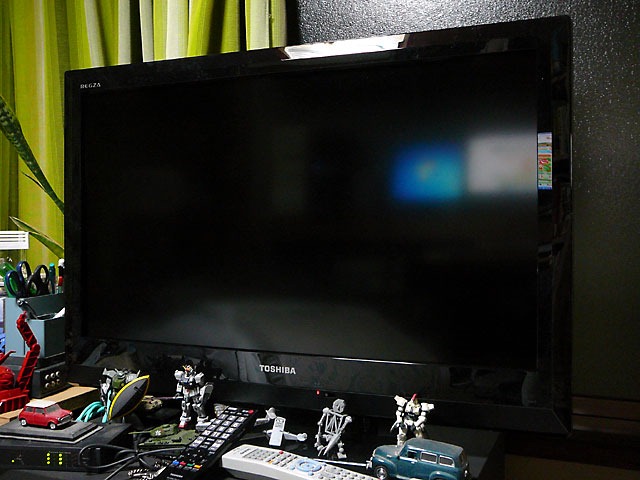
What are the coordinates of `edge of television screen` in the screenshot? It's located at (198, 345), (280, 351), (420, 361), (537, 178).